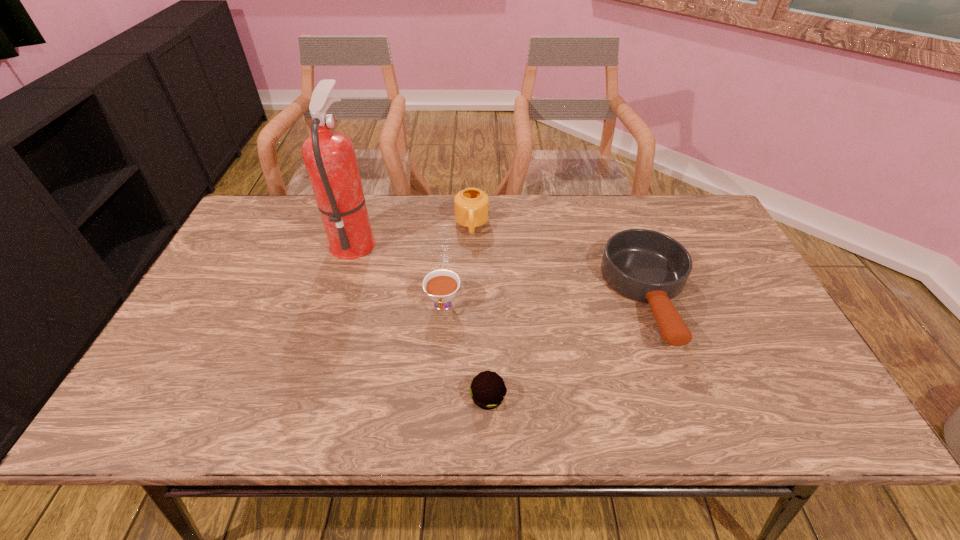
Locate an element on the screen. vacant position at the far right corner of the desktop is located at coordinates (708, 228).

Where is `unoccupied position between the teacup and the rightmost object`? This screenshot has height=540, width=960. unoccupied position between the teacup and the rightmost object is located at coordinates (546, 301).

You are a GUI agent. You are given a task and a screenshot of the screen. Output one action in this format:
    pyautogui.click(x=<x>, y=<y>)
    Task: Click on the free spot between the nearest object and the tallest object
    This screenshot has width=960, height=540.
    Given the screenshot: What is the action you would take?
    pyautogui.click(x=420, y=319)

Identify the location of free spot between the rightmost object and the teacup. The width and height of the screenshot is (960, 540). (546, 301).

Find the location of a particular element. The image size is (960, 540). unoccupied position between the pan and the teacup is located at coordinates (546, 301).

Where is `free point between the tallest object and the teacup`? This screenshot has height=540, width=960. free point between the tallest object and the teacup is located at coordinates (398, 273).

The width and height of the screenshot is (960, 540). In order to click on vacant space that is in between the tallest object and the second tallest object in this screenshot , I will do `click(413, 233)`.

Find the location of a particular element. The width and height of the screenshot is (960, 540). vacant point located between the leftmost object and the fourth shortest object is located at coordinates (413, 233).

Where is `free space between the fire extinguisher and the teacup`? This screenshot has width=960, height=540. free space between the fire extinguisher and the teacup is located at coordinates (398, 273).

Image resolution: width=960 pixels, height=540 pixels. What are the coordinates of `free space between the shortest object and the pan` in the screenshot? It's located at (568, 347).